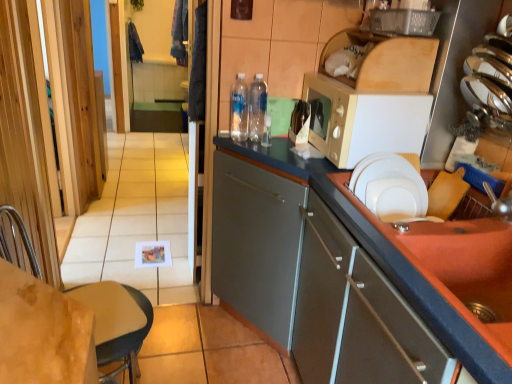
You are a GUI agent. You are given a task and a screenshot of the screen. Output one action in this format:
    pyautogui.click(x=<x>, y=<y>)
    Task: Click on the spots to the right of clear plastic water bottles at center, the third bottle when ordered from right to left
    This screenshot has height=384, width=512.
    Given the screenshot: What is the action you would take?
    pyautogui.click(x=278, y=145)